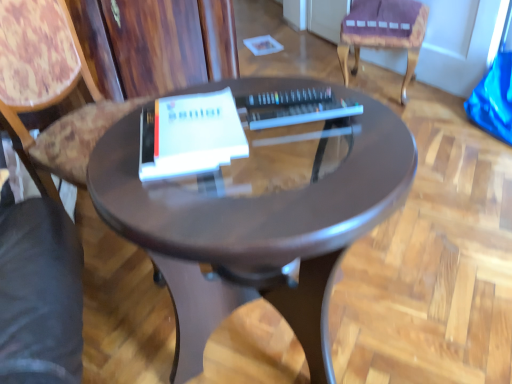
At what (x,y) coordinates should I click in order to perform the action: click on free space in front of white matte paperback book at center. Please return your answer as a coordinate pair (x, y). The image size is (512, 384). Looking at the image, I should click on (194, 212).